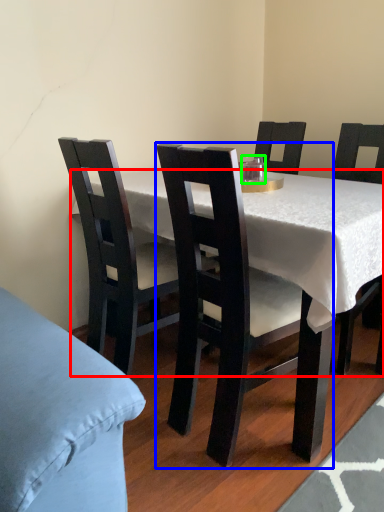
Question: Which object is positioned closest to desk (highlighted by a red box)? Select from chair (highlighted by a blue box) and coffee cup (highlighted by a green box).

Choices:
 (A) chair
 (B) coffee cup

Answer: (A)